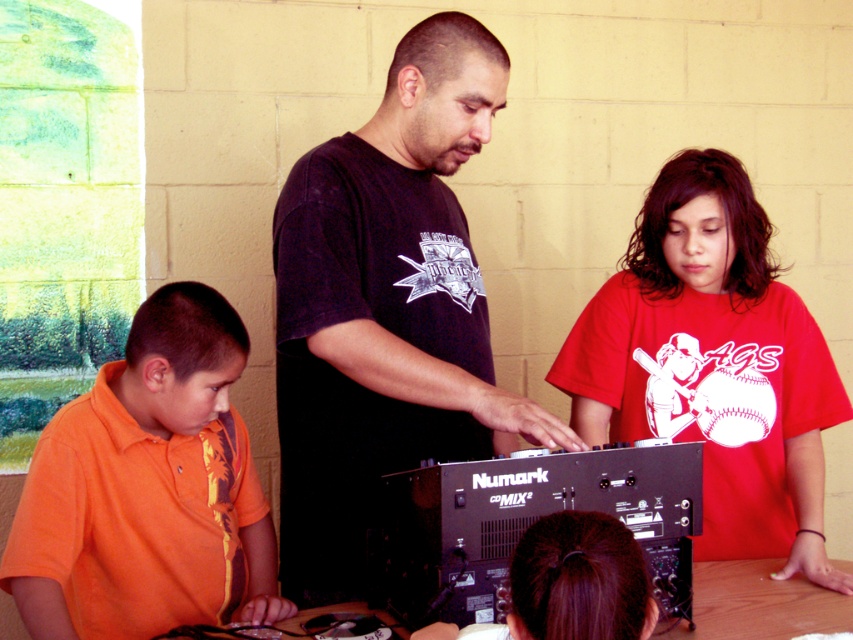
Based on the scene description, can you determine which object is taller between the red matte shirt at center and the wooden table at center?

The red matte shirt at center is much taller than the wooden table at center.

Based on the photo, based on the scene description, can you determine the spatial relationship between the orange cotton shirt at lower left and the black matte shirt at center?

The orange cotton shirt at lower left is behind the black matte shirt at center.

Based on the photo, you are standing in the DJ mixing console area and see the point at coordinates (386, 308). Which object is located at that point?

The point at coordinates (386, 308) is located on the black matte shirt at center.